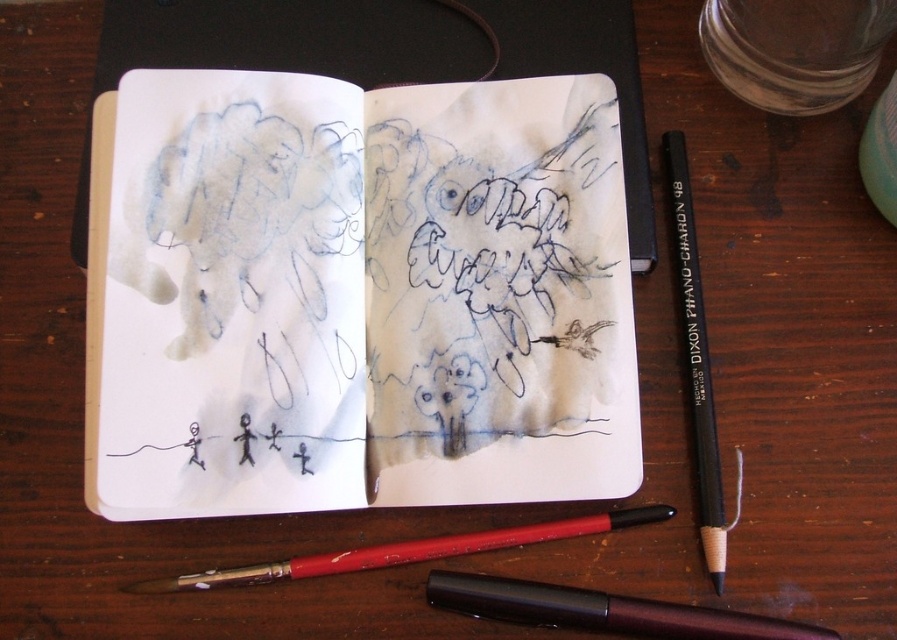
Question: Which point is farther to the camera?

Choices:
 (A) (218, 582)
 (B) (673, 216)
 (C) (497, 493)
 (D) (562, 609)

Answer: (B)

Question: Where is blue ink sketchbook at center located in relation to red wood pencil at lower center in the image?

Choices:
 (A) left
 (B) right

Answer: (A)

Question: Which point is farther to the camera?

Choices:
 (A) metallic burgundy pen at lower center
 (B) black pencil at right

Answer: (B)

Question: Does metallic burgundy pen at lower center have a greater width compared to black pencil at right?

Choices:
 (A) no
 (B) yes

Answer: (B)

Question: Which of these objects is positioned closest to the metallic burgundy pen at lower center?

Choices:
 (A) blue ink sketchbook at center
 (B) red wood pencil at lower center
 (C) black pencil at right

Answer: (B)

Question: Is red wood pencil at lower center positioned in front of black pencil at right?

Choices:
 (A) no
 (B) yes

Answer: (B)